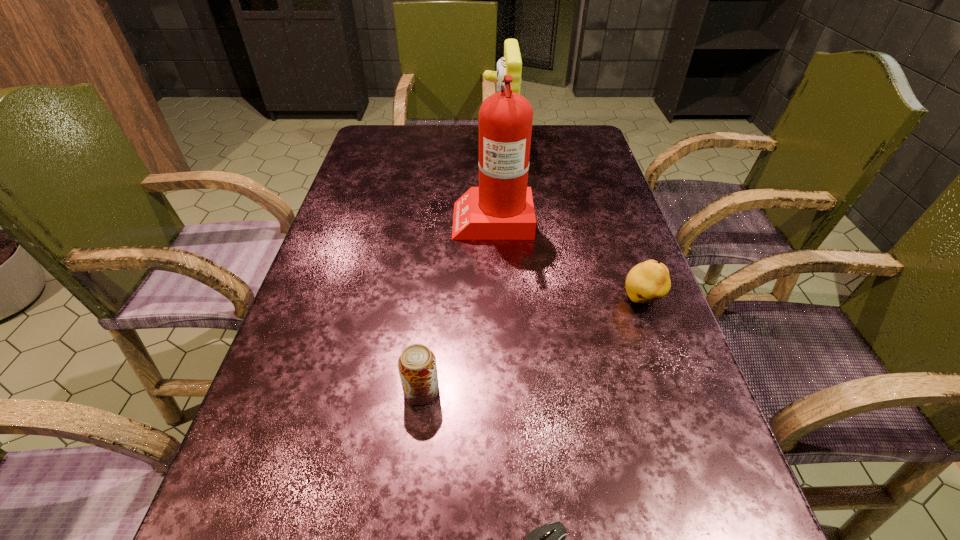
Image resolution: width=960 pixels, height=540 pixels. Find the location of `fire extinguisher`. fire extinguisher is located at coordinates point(501,208).

The width and height of the screenshot is (960, 540). Identify the location of the fourth nearest object. (501, 208).

Find the location of a particular element. The image size is (960, 540). the fourth shortest object is located at coordinates (510, 64).

You are a GUI agent. You are given a task and a screenshot of the screen. Output one action in this format:
    pyautogui.click(x=<x>, y=<y>)
    Task: Click on the sponge
    The width and height of the screenshot is (960, 540).
    Given the screenshot: What is the action you would take?
    pyautogui.click(x=510, y=64)

Find the location of a particular element. The height and width of the screenshot is (540, 960). pear is located at coordinates (646, 282).

This screenshot has width=960, height=540. Find the location of `the rightmost object`. the rightmost object is located at coordinates (646, 282).

Locate an element on the screen. the leftmost object is located at coordinates (417, 366).

Find the location of a particular element. Image resolution: width=960 pixels, height=540 pixels. beer can is located at coordinates (417, 366).

This screenshot has height=540, width=960. Identify the location of vacant space situated on the front-facing side of the fire extinguisher. (418, 218).

Locate an element on the screen. Image resolution: width=960 pixels, height=540 pixels. free space located on the front-facing side of the fire extinguisher is located at coordinates tap(389, 218).